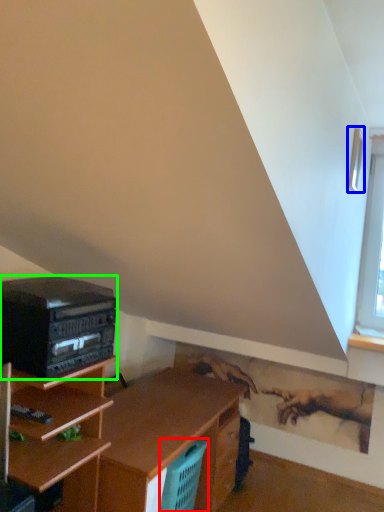
Question: Which is farther away from basket (highlighted by a red box)? window (highlighted by a blue box) or stereo (highlighted by a green box)?

Choices:
 (A) window
 (B) stereo

Answer: (A)